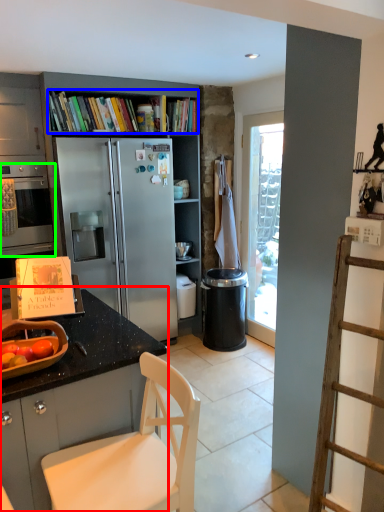
Question: Based on their relative distances, which object is nearer to countertop (highlighted by a red box)? Choose from book (highlighted by a blue box) and oven (highlighted by a green box).

Choices:
 (A) book
 (B) oven

Answer: (B)